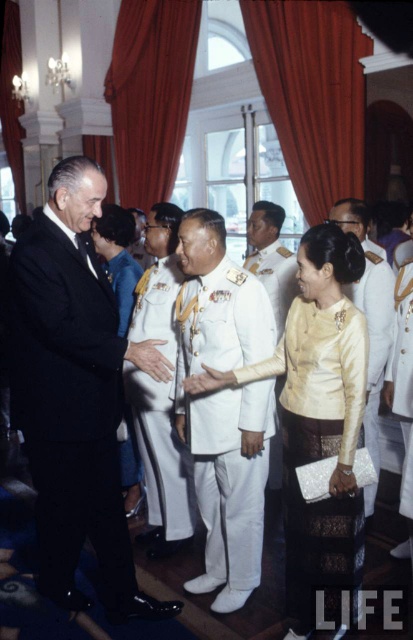
You are a photographer standing at the back of the grand hall. You need to take a photo of both the white uniform at center and the white glossy uniform at center. Can you fit both subjects into a single frame if your camera has a minimum distance requirement of 30 inches between subjects to capture them clearly?

The distance between the white uniform at center and the white glossy uniform at center is 29.30 inches, which is less than the camera requirement of 30 inches. Therefore, the camera cannot clearly capture both subjects in a single frame.

You are an event planner arranging seating for a formal dinner. The silk cream blouse at center and the white uniform at center are part of the guest attire. Which garment has a larger width measurement?

The silk cream blouse at center has a larger width measurement than the white uniform at center, as stated in the description that the silk cream blouse at center surpasses the white uniform at center in width.

You are a photographer at the event and need to ensure that both the white uniform at center and the white glossy uniform at center are clearly visible in the photo. Given their sizes, which uniform should you focus on first to ensure it is in sharp focus?

The white uniform at center is larger in size than the white glossy uniform at center, so you should focus on the white uniform at center first to ensure it is in sharp focus since larger objects require more precise focus adjustments.